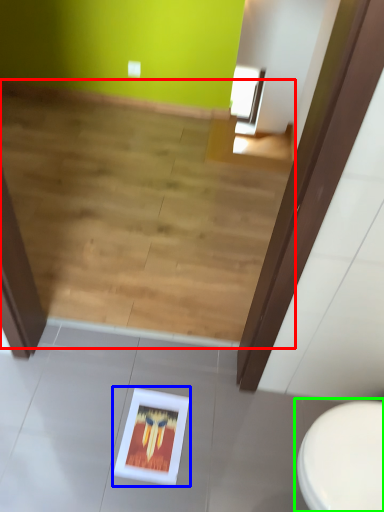
Question: Which is farther away from stairwell (highlighted by a red box)? picture frame (highlighted by a blue box) or toilet (highlighted by a green box)?

Choices:
 (A) picture frame
 (B) toilet

Answer: (B)